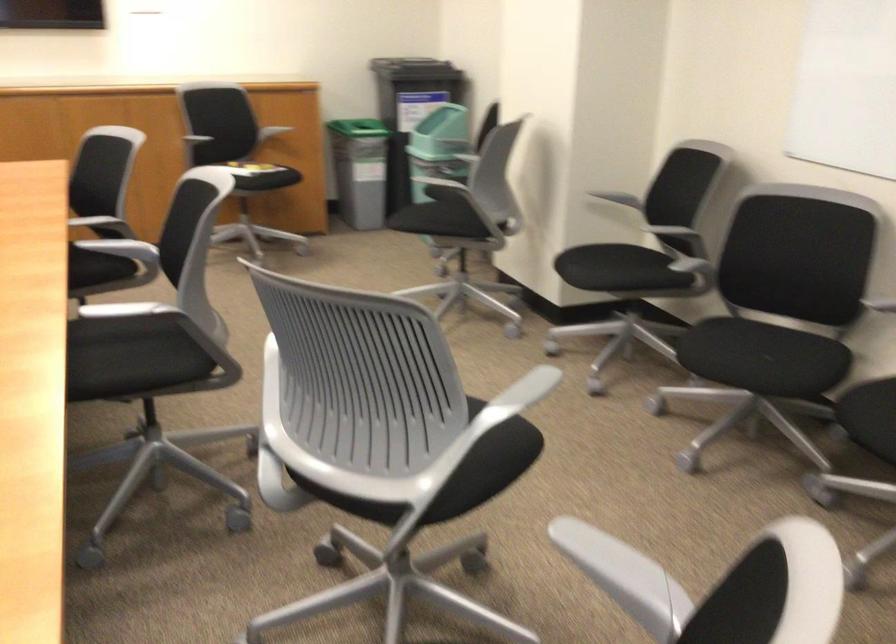
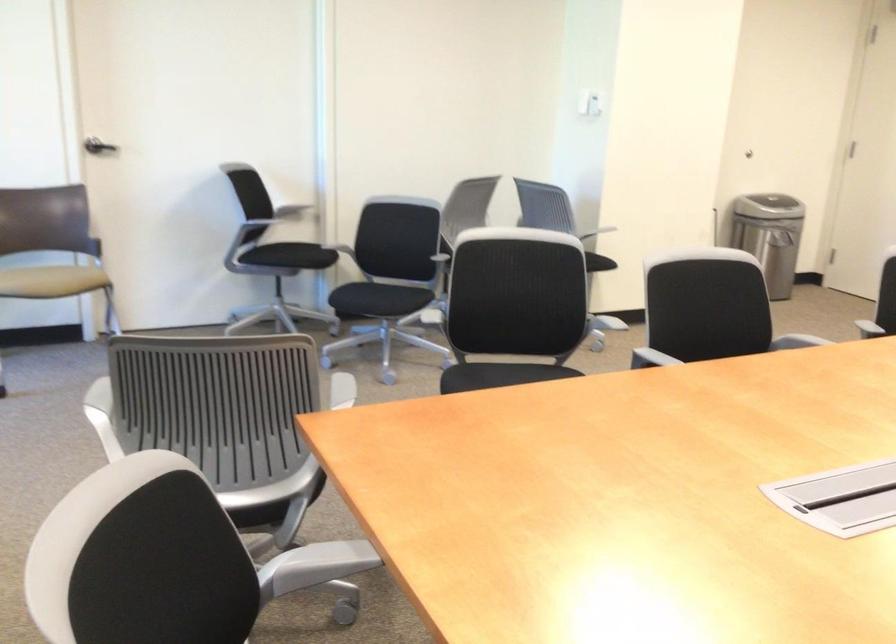
Question: The camera is either moving clockwise (left) or counter-clockwise (right) around the object. The first image is from the beginning of the video and the second image is from the end. Is the camera moving left or right when shooting the video?

Choices:
 (A) Left
 (B) Right

Answer: (B)